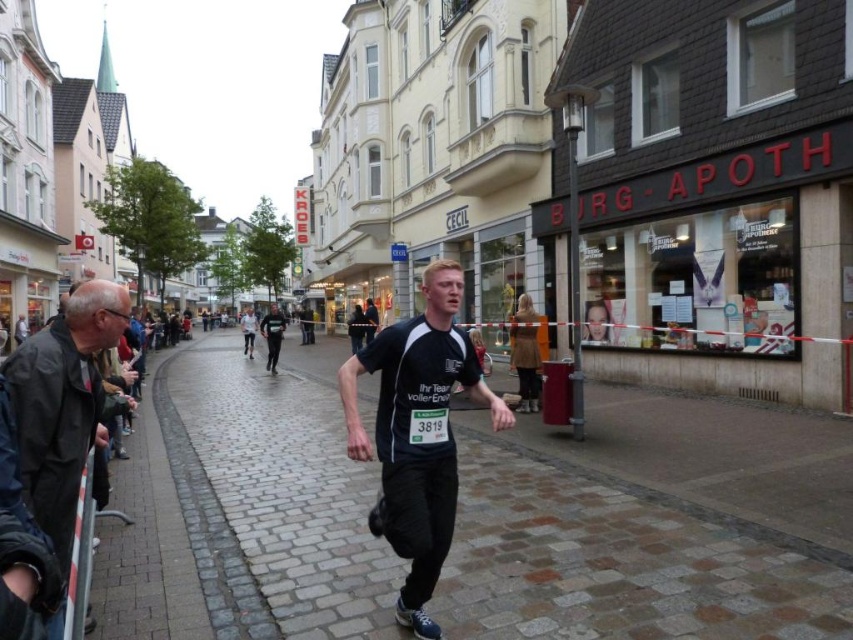
Question: Estimate the real-world distances between objects in this image. Which object is closer to the black matte jacket at left?

Choices:
 (A) black matte running shirt at center
 (B) cobblestone pavement at center

Answer: (A)

Question: From the image, what is the correct spatial relationship of cobblestone pavement at center in relation to black matte running shirt at center?

Choices:
 (A) right
 (B) left

Answer: (A)

Question: Does red plastic sign at center right have a larger size compared to dark gray fabric jacket at center?

Choices:
 (A) yes
 (B) no

Answer: (B)

Question: Which of the following is the farthest from the observer?

Choices:
 (A) (65, 515)
 (B) (218, 381)

Answer: (B)

Question: Is black matte running shirt at center positioned in front of black matte jacket at left?

Choices:
 (A) yes
 (B) no

Answer: (B)

Question: Which object appears farthest from the camera in this image?

Choices:
 (A) red plastic sign at center right
 (B) dark gray fabric jacket at center

Answer: (B)